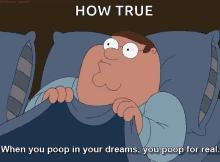
The height and width of the screenshot is (162, 220). I want to click on pillow, so click(208, 91).